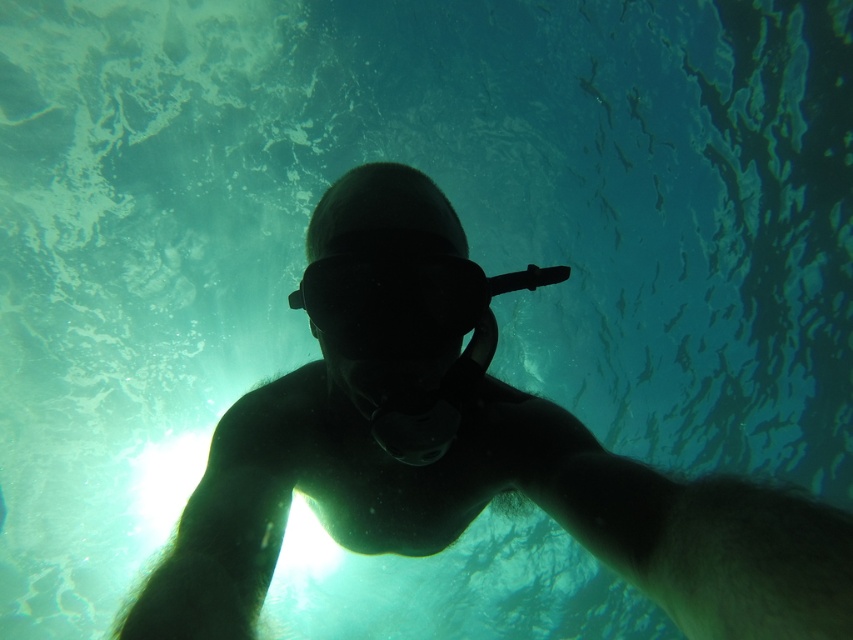
Does silhouette snorkel at center lie behind black matte goggles at center?

No, it is not.

Is silhouette snorkel at center to the right of black matte goggles at center from the viewer's perspective?

No, silhouette snorkel at center is not to the right of black matte goggles at center.

Locate an element on the screen. The image size is (853, 640). silhouette snorkel at center is located at coordinates (482, 508).